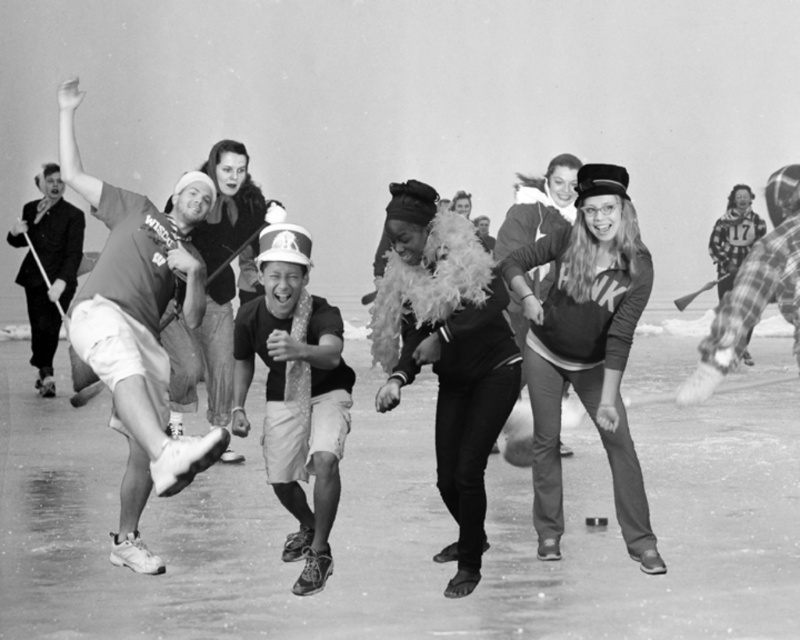
You are a photographer trying to capture the matte brown shirt at left and the polka dot tie at center in a single frame. Based on their positions, can you tell me which one is covering part of the other?

The matte brown shirt at left is positioned over the polka dot tie at center, so it is covering part of it.

From the picture: You are a photographer who wants to capture a clear shot of both the feather boa at center and the polka dot tie at center. Since you want to focus on their height differences, which object should you adjust your camera angle to look up at?

You should adjust your camera angle to look up at the feather boa at center because it is much taller than the polka dot tie at center.

You are a photographer at the event and want to capture a closeup shot of both the feather boa at center and the polka dot tie at center in the same frame. Based on their distance, can you fit both into the shot without moving the camera?

The feather boa at center is 25.55 inches from the polka dot tie at center. Since the distance between them is relatively small, you can likely fit both into the same frame without moving the camera.